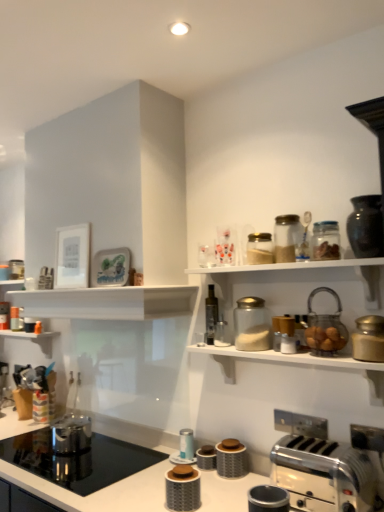
Question: Considering the relative positions of metallic silver canister at center, the 10th appliance positioned from the right, and gold metallic canister at upper right, the eleventh appliance positioned from the left, in the image provided, is metallic silver canister at center, the 10th appliance positioned from the right, to the left of gold metallic canister at upper right, the eleventh appliance positioned from the left, from the viewer's perspective?

Choices:
 (A) no
 (B) yes

Answer: (B)

Question: From a real-world perspective, is metallic silver canister at center, the third appliance when ordered from left to right, below gold metallic canister at upper right, which is the 2th appliance from right to left?

Choices:
 (A) no
 (B) yes

Answer: (B)

Question: Is metallic silver canister at center, the 10th appliance positioned from the right, facing towards gold metallic canister at upper right, which is the 2th appliance from right to left?

Choices:
 (A) no
 (B) yes

Answer: (A)

Question: Can you confirm if metallic silver canister at center, the third appliance when ordered from left to right, is bigger than gold metallic canister at upper right, which is the 2th appliance from right to left?

Choices:
 (A) yes
 (B) no

Answer: (B)

Question: Is metallic silver canister at center, the third appliance when ordered from left to right, not inside gold metallic canister at upper right, the eleventh appliance positioned from the left?

Choices:
 (A) no
 (B) yes

Answer: (B)

Question: Can you confirm if metallic silver canister at center, the 10th appliance positioned from the right, is positioned to the right of gold metallic canister at upper right, which is the 2th appliance from right to left?

Choices:
 (A) yes
 (B) no

Answer: (B)

Question: Is translucent glass bottle at center to the left of metallic silver toaster at lower right, which ranks as the seventh appliance in right-to-left order, from the viewer's perspective?

Choices:
 (A) yes
 (B) no

Answer: (A)

Question: Is metallic silver toaster at lower right, which ranks as the 6th appliance in left-to-right order, surrounded by translucent glass bottle at center?

Choices:
 (A) yes
 (B) no

Answer: (B)

Question: Does translucent glass bottle at center lie in front of metallic silver toaster at lower right, which ranks as the seventh appliance in right-to-left order?

Choices:
 (A) yes
 (B) no

Answer: (B)

Question: Is translucent glass bottle at center completely or partially outside of metallic silver toaster at lower right, which ranks as the 6th appliance in left-to-right order?

Choices:
 (A) yes
 (B) no

Answer: (A)

Question: Considering the relative positions of translucent glass bottle at center and metallic silver toaster at lower right, which ranks as the seventh appliance in right-to-left order, in the image provided, is translucent glass bottle at center behind metallic silver toaster at lower right, which ranks as the seventh appliance in right-to-left order,?

Choices:
 (A) no
 (B) yes

Answer: (B)

Question: From the image's perspective, is translucent glass bottle at center located beneath metallic silver toaster at lower right, which ranks as the 6th appliance in left-to-right order?

Choices:
 (A) yes
 (B) no

Answer: (B)

Question: Is there a large distance between gold metallic canister at upper right, which is the 2th appliance from right to left, and shiny dark brown vase at upper right, which is the 12th appliance in left-to-right order?

Choices:
 (A) no
 (B) yes

Answer: (A)